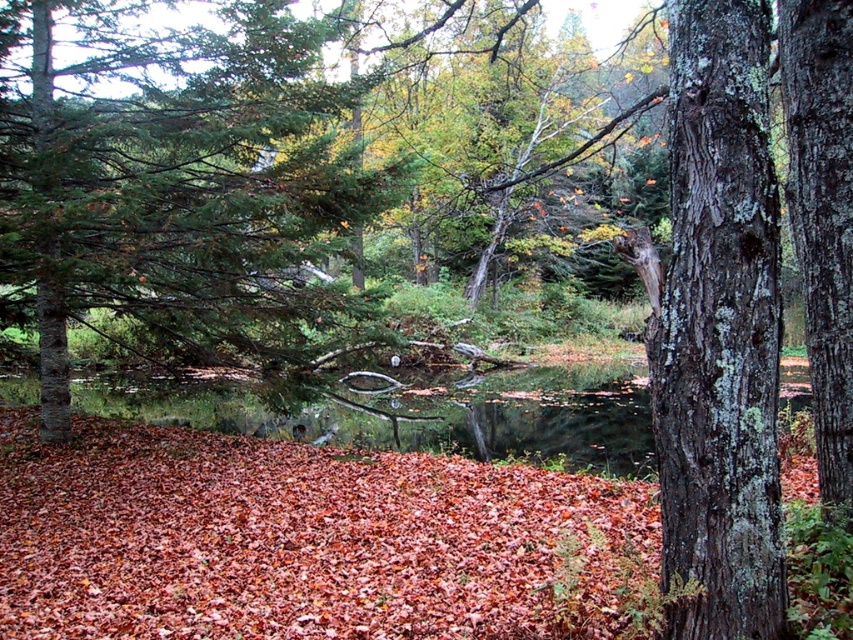
Is autumn leaves at lower center below grayish-brown bark tree trunk at right?

Yes, autumn leaves at lower center is below grayish-brown bark tree trunk at right.

Consider the image. Does autumn leaves at lower center appear on the left side of grayish-brown bark tree trunk at right?

In fact, autumn leaves at lower center is to the right of grayish-brown bark tree trunk at right.

The width and height of the screenshot is (853, 640). What do you see at coordinates (300, 540) in the screenshot? I see `autumn leaves at lower center` at bounding box center [300, 540].

Find the location of a particular element. autumn leaves at lower center is located at coordinates (300, 540).

Can you confirm if autumn leaves at lower center is positioned to the left of lichen-covered bark tree at center-right?

Indeed, autumn leaves at lower center is positioned on the left side of lichen-covered bark tree at center-right.

Does point (618, 560) come closer to viewer compared to point (798, 88)?

That is False.

Find the location of a particular element. autumn leaves at lower center is located at coordinates 300,540.

Is grayish-brown bark tree trunk at right closer to the viewer compared to lichen-covered bark tree at center-right?

Yes, it is.

What do you see at coordinates (718, 330) in the screenshot? I see `grayish-brown bark tree trunk at right` at bounding box center [718, 330].

Measure the distance between point (711, 602) and camera.

Point (711, 602) is 3.14 meters from camera.

Find the location of a particular element. grayish-brown bark tree trunk at right is located at coordinates (718, 330).